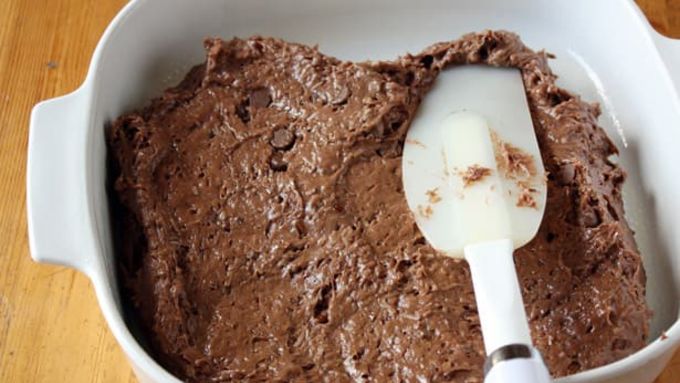
The width and height of the screenshot is (680, 383). I want to click on casserole dish, so click(x=71, y=182).